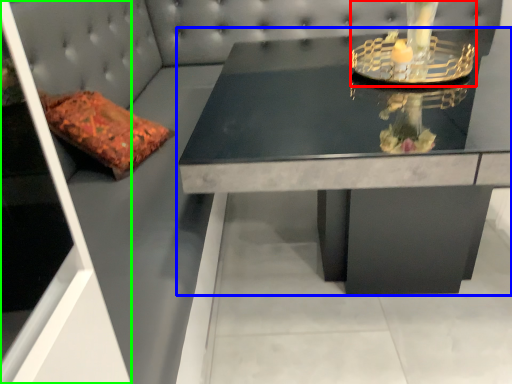
Question: Estimate the real-world distances between objects in this image. Which object is closer to candle holder (highlighted by a red box), table (highlighted by a blue box) or glass door (highlighted by a green box)?

Choices:
 (A) table
 (B) glass door

Answer: (A)